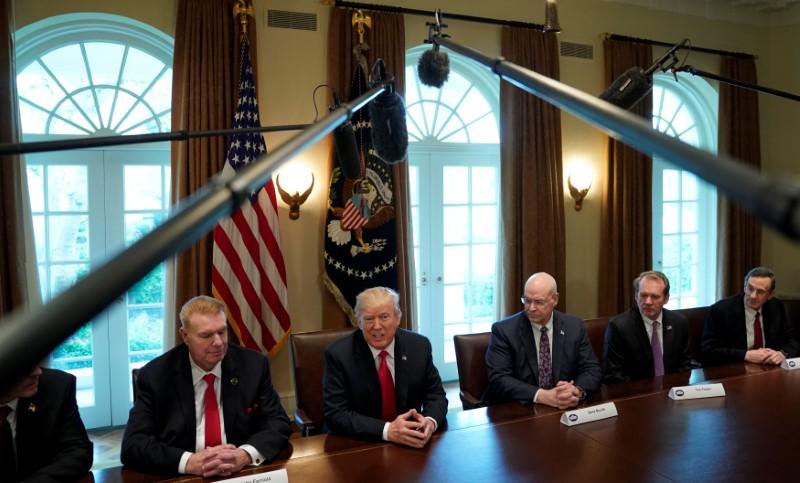
Locate an element on the screen. This screenshot has width=800, height=483. table is located at coordinates coord(522,457).